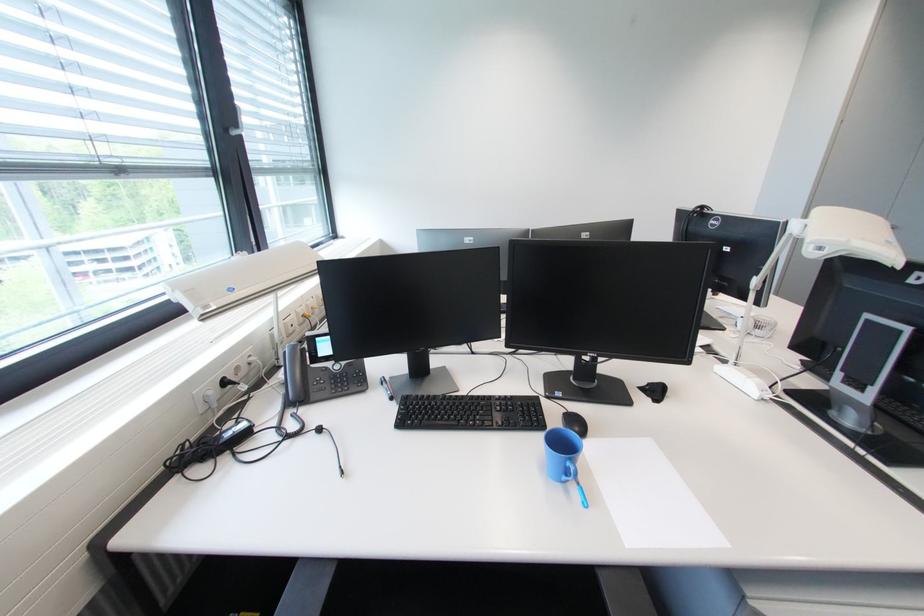
Find where to resting arm the black chair armrest. Please return your answer as a coordinate pair (x, y).

(624, 591)